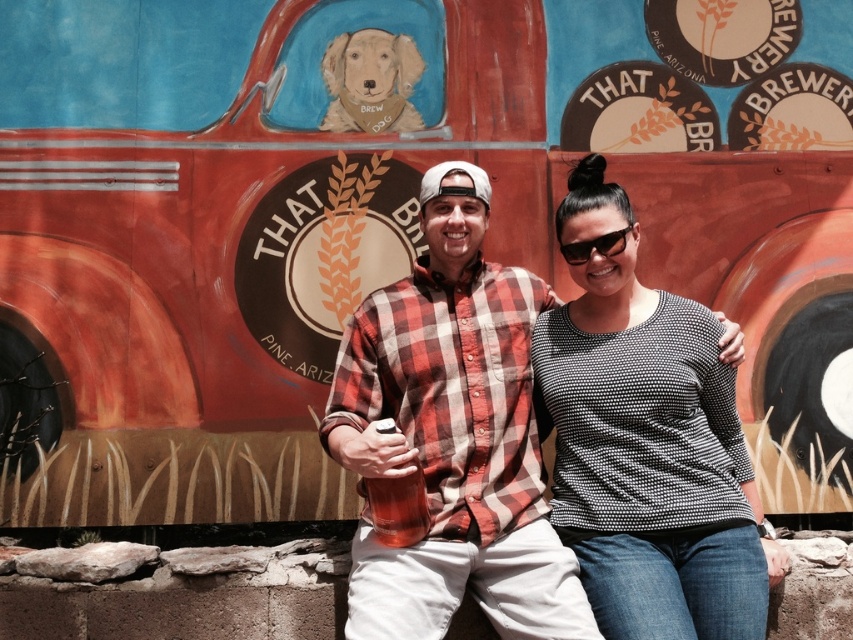
Does plaid cotton shirt at center appear over golden fur dog at upper center?

No, plaid cotton shirt at center is not above golden fur dog at upper center.

Who is more distant from viewer, (416, 445) or (347, 129)?

The point (347, 129) is more distant.

Who is more forward, (432, 573) or (375, 100)?

Positioned in front is point (432, 573).

The width and height of the screenshot is (853, 640). Identify the location of plaid cotton shirt at center. (453, 435).

Based on the photo, which of these two, plaid cotton shirt at center or black dotted sweater at center, stands taller?

Standing taller between the two is plaid cotton shirt at center.

Does plaid cotton shirt at center appear on the right side of black dotted sweater at center?

No, plaid cotton shirt at center is not to the right of black dotted sweater at center.

Describe the element at coordinates (453, 435) in the screenshot. I see `plaid cotton shirt at center` at that location.

The width and height of the screenshot is (853, 640). Find the location of `plaid cotton shirt at center`. plaid cotton shirt at center is located at coordinates (453, 435).

Who is higher up, plaid cotton shirt at center or black plastic sunglasses at center?

black plastic sunglasses at center is above.

Does plaid cotton shirt at center appear under black plastic sunglasses at center?

Correct, plaid cotton shirt at center is located below black plastic sunglasses at center.

Is point (393, 321) positioned after point (595, 241)?

Yes, point (393, 321) is behind point (595, 241).

The height and width of the screenshot is (640, 853). What are the coordinates of `plaid cotton shirt at center` in the screenshot? It's located at (453, 435).